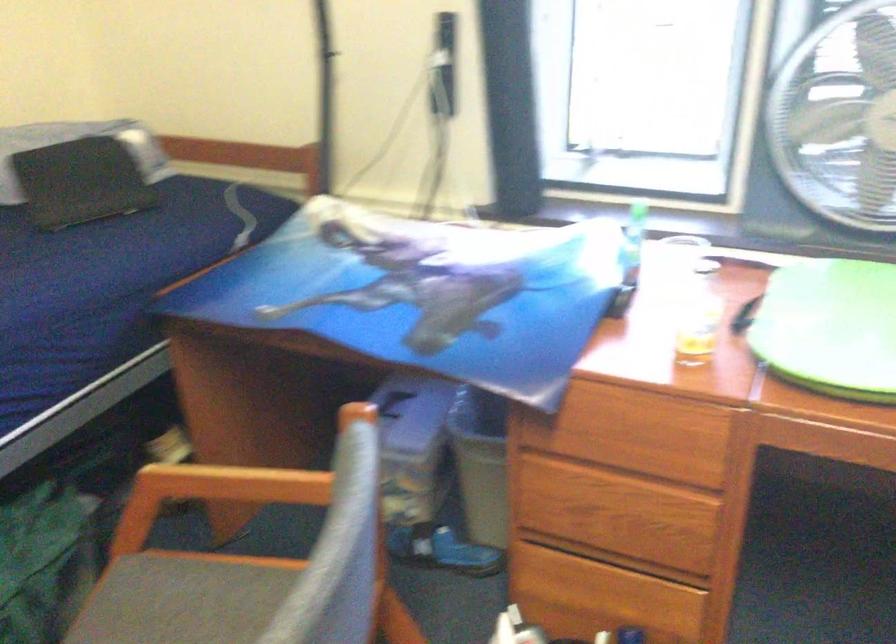
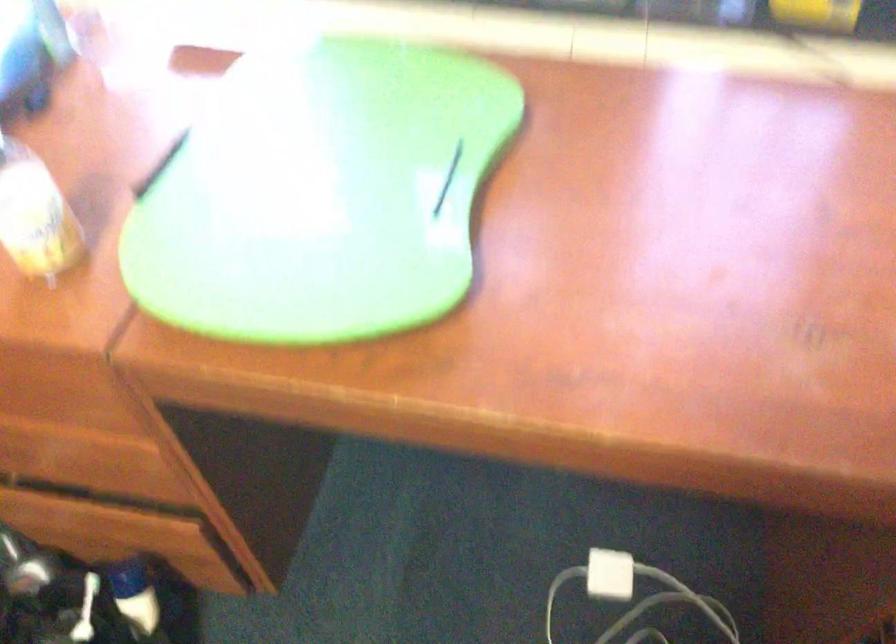
The images are taken continuously from a first-person perspective. In which direction are you moving?

The movement direction of the cameraman is right, forward.